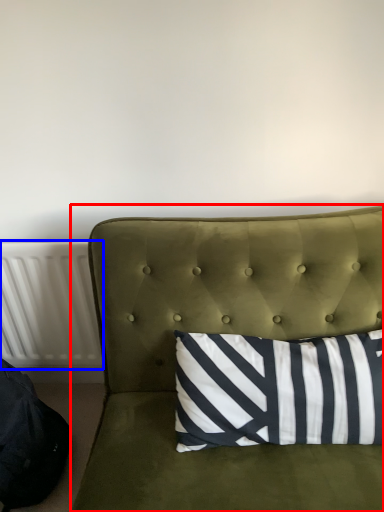
Question: Which of the following is the farthest to the observer, studio couch (highlighted by a red box) or radiator (highlighted by a blue box)?

Choices:
 (A) studio couch
 (B) radiator

Answer: (B)